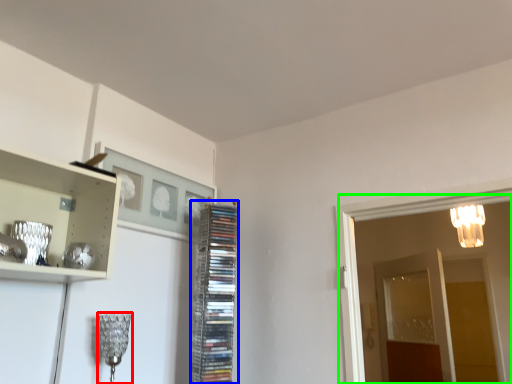
Question: Which object is the farthest from lamp (highlighted by a red box)? Choose among these: cabinet (highlighted by a blue box) or glass door (highlighted by a green box).

Choices:
 (A) cabinet
 (B) glass door

Answer: (B)